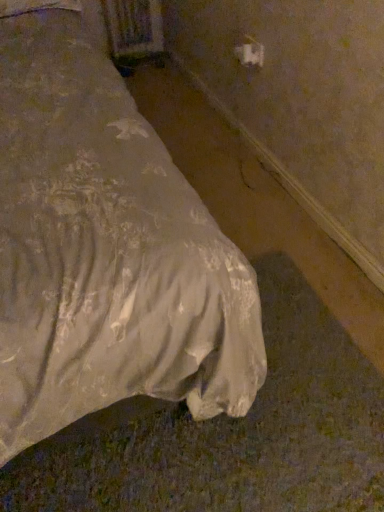
Locate an element on the screen. The height and width of the screenshot is (512, 384). white fabric bed at lower left is located at coordinates (105, 251).

This screenshot has width=384, height=512. Describe the element at coordinates (105, 251) in the screenshot. I see `white fabric bed at lower left` at that location.

What do you see at coordinates (250, 52) in the screenshot?
I see `white plastic outlet at upper right` at bounding box center [250, 52].

Where is `white plastic outlet at upper right`? This screenshot has height=512, width=384. white plastic outlet at upper right is located at coordinates (250, 52).

Find the location of a particular element. This screenshot has width=384, height=512. white fabric bed at lower left is located at coordinates (105, 251).

Based on their positions, is white fabric bed at lower left located to the left or right of white plastic outlet at upper right?

white fabric bed at lower left is positioned on white plastic outlet at upper right's left side.

Is white fabric bed at lower left further to camera compared to white plastic outlet at upper right?

No, white fabric bed at lower left is closer to the camera.

Which is nearer, (21, 158) or (237, 47)?

Point (21, 158).

From the image's perspective, is white fabric bed at lower left located above or below white plastic outlet at upper right?

Clearly, from the image's perspective, white fabric bed at lower left is below white plastic outlet at upper right.

From a real-world perspective, between white fabric bed at lower left and white plastic outlet at upper right, who is vertically higher?

In real-world perspective, white fabric bed at lower left is above.

Is white fabric bed at lower left thinner than white plastic outlet at upper right?

No.

From the picture: Is white fabric bed at lower left taller than white plastic outlet at upper right?

Indeed, white fabric bed at lower left has a greater height compared to white plastic outlet at upper right.

Can you confirm if white fabric bed at lower left is smaller than white plastic outlet at upper right?

No, white fabric bed at lower left is not smaller than white plastic outlet at upper right.

Choose the correct answer: Is white fabric bed at lower left inside white plastic outlet at upper right or outside it?

The correct answer is: outside.

Is white fabric bed at lower left positioned far away from white plastic outlet at upper right?

white fabric bed at lower left is far away from white plastic outlet at upper right.

Is white fabric bed at lower left oriented away from white plastic outlet at upper right?

white fabric bed at lower left is not turned away from white plastic outlet at upper right.

How different are the orientations of white fabric bed at lower left and white plastic outlet at upper right in degrees?

The angle between the facing direction of white fabric bed at lower left and the facing direction of white plastic outlet at upper right is 87.9 degrees.

The image size is (384, 512). Find the location of `electric outlet lying on the right of white fabric bed at lower left`. electric outlet lying on the right of white fabric bed at lower left is located at coordinates (250, 52).

Considering the relative positions of white plastic outlet at upper right and white fabric bed at lower left in the image provided, is white plastic outlet at upper right to the left or to the right of white fabric bed at lower left?

In the image, white plastic outlet at upper right appears on the right side of white fabric bed at lower left.

Is the depth of white plastic outlet at upper right greater than that of white fabric bed at lower left?

Yes, white plastic outlet at upper right is further from the viewer.

Does point (257, 64) appear closer or farther from the camera than point (106, 209)?

Point (257, 64).

From the image's perspective, relative to white fabric bed at lower left, is white plastic outlet at upper right above or below?

white plastic outlet at upper right is situated higher than white fabric bed at lower left in the image.

From a real-world perspective, between white plastic outlet at upper right and white fabric bed at lower left, who is vertically lower?

white plastic outlet at upper right.

Looking at this image, considering the sizes of objects white plastic outlet at upper right and white fabric bed at lower left in the image provided, who is wider, white plastic outlet at upper right or white fabric bed at lower left?

white fabric bed at lower left is wider.

Is white plastic outlet at upper right shorter than white fabric bed at lower left?

Correct, white plastic outlet at upper right is not as tall as white fabric bed at lower left.

Who is smaller, white plastic outlet at upper right or white fabric bed at lower left?

Smaller between the two is white plastic outlet at upper right.

Is white plastic outlet at upper right spatially inside white fabric bed at lower left, or outside of it?

white plastic outlet at upper right lies outside white fabric bed at lower left.

Are white plastic outlet at upper right and white fabric bed at lower left making contact?

No, white plastic outlet at upper right is not making contact with white fabric bed at lower left.

Is white plastic outlet at upper right oriented away from white fabric bed at lower left?

No, white plastic outlet at upper right is not facing the opposite direction of white fabric bed at lower left.

Measure the distance between white plastic outlet at upper right and white fabric bed at lower left.

white plastic outlet at upper right and white fabric bed at lower left are 3.42 feet apart from each other.

At what (x,y) coordinates should I click in order to perform the action: click on electric outlet below the white fabric bed at lower left (from a real-world perspective). Please return your answer as a coordinate pair (x, y). The height and width of the screenshot is (512, 384). Looking at the image, I should click on (250, 52).

Find the location of a particular element. The height and width of the screenshot is (512, 384). bed in front of the white plastic outlet at upper right is located at coordinates (105, 251).

You are a GUI agent. You are given a task and a screenshot of the screen. Output one action in this format:
    pyautogui.click(x=<x>, y=<y>)
    Task: Click on the bed that appears above the white plastic outlet at upper right (from a real-world perspective)
    This screenshot has width=384, height=512.
    Given the screenshot: What is the action you would take?
    pyautogui.click(x=105, y=251)